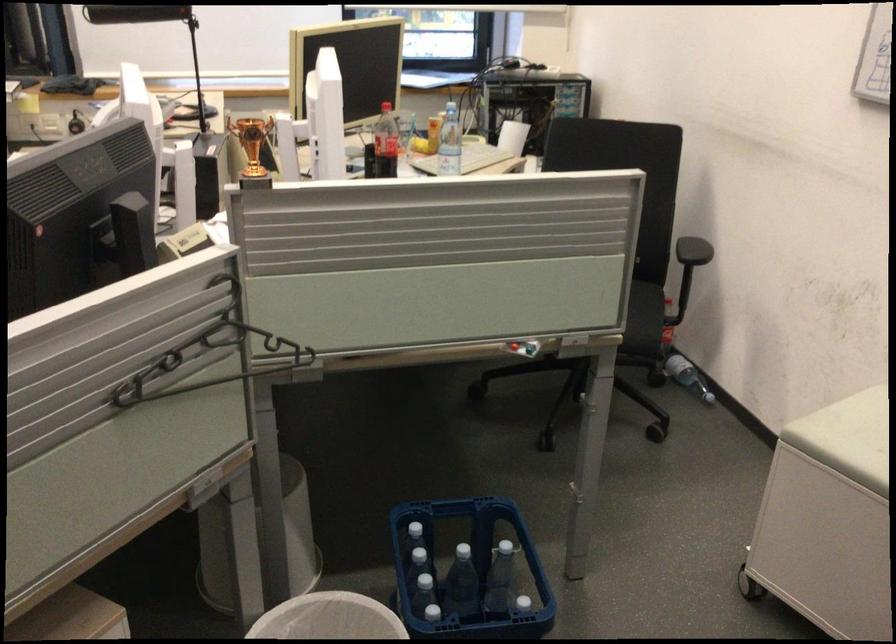
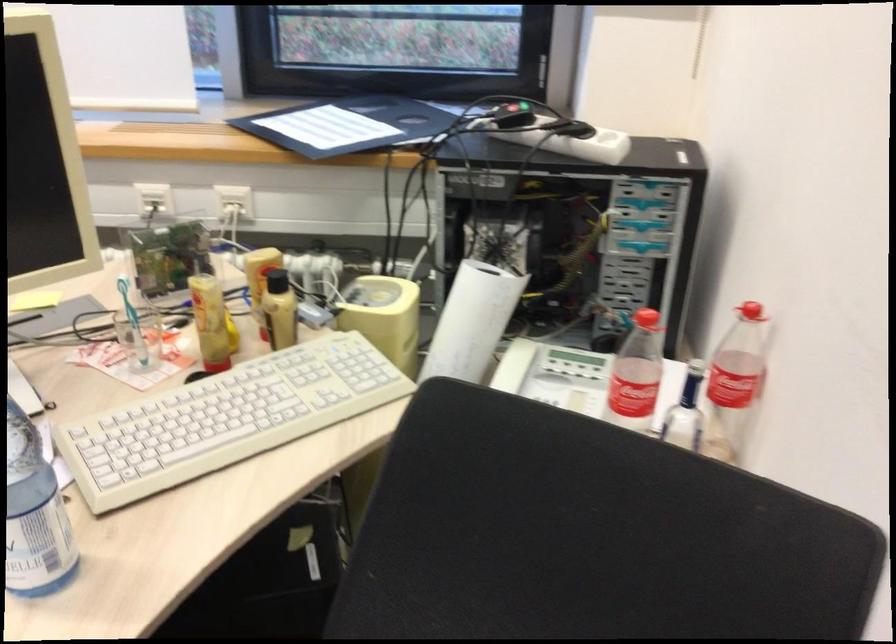
Question: The images are taken continuously from a first-person perspective. In which direction are you moving?

Choices:
 (A) Left
 (B) Right
 (C) Forward
 (D) Backward

Answer: (C)